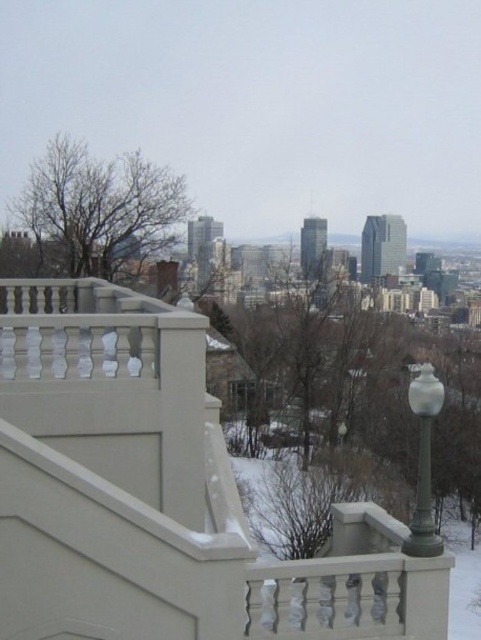
Is white textured balcony at center above white glass lamp post at right?

Yes, white textured balcony at center is above white glass lamp post at right.

Where is `white textured balcony at center`? white textured balcony at center is located at coordinates (161, 493).

Where is `white textured balcony at center`? The image size is (481, 640). white textured balcony at center is located at coordinates (161, 493).